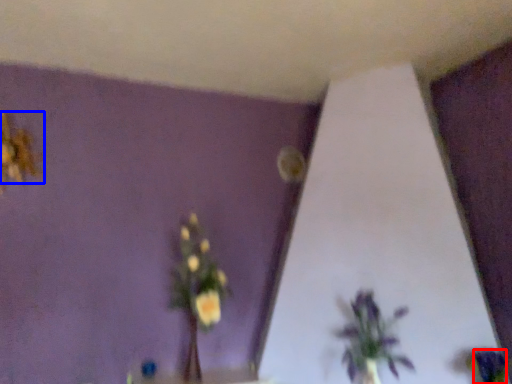
Question: Which point is further to the camera, flower (highlighted by a red box) or flower (highlighted by a blue box)?

Choices:
 (A) flower
 (B) flower

Answer: (B)